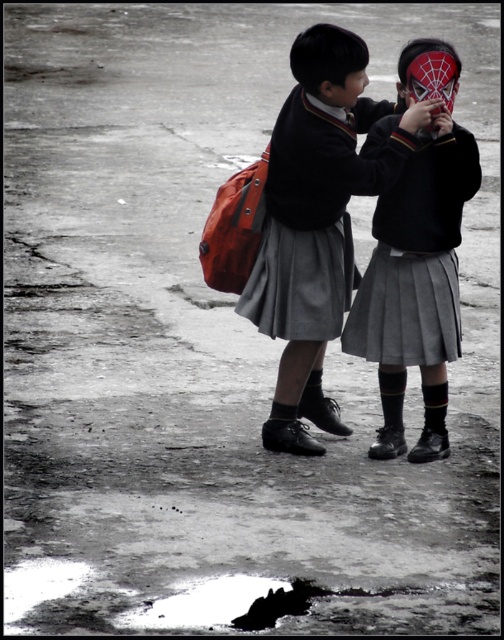
You are a photographer trying to capture a candid shot of the children. Since the matte black school uniform at center and the matte gray skirt at center are at different distances, which one would appear larger in your photo?

The matte black school uniform at center appears larger in the photo because it is closer to the camera than the matte gray skirt at center.

You are a photographer trying to capture the two children in the scene. You want to ensure the matte black school uniform at center and the matte gray skirt at center are both visible in your shot. Based on their positions, which one should you focus on first to frame them properly?

The matte black school uniform at center is to the left of the matte gray skirt at center, so you should focus on the matte gray skirt at center first to ensure both are in frame.

You are a photographer trying to capture a candid shot of the children. Since the matte black school uniform at center and the matte gray skirt at center are both in focus, which one would appear wider in the photo?

The matte black school uniform at center would appear wider in the photo because its width surpasses that of the matte gray skirt at center.